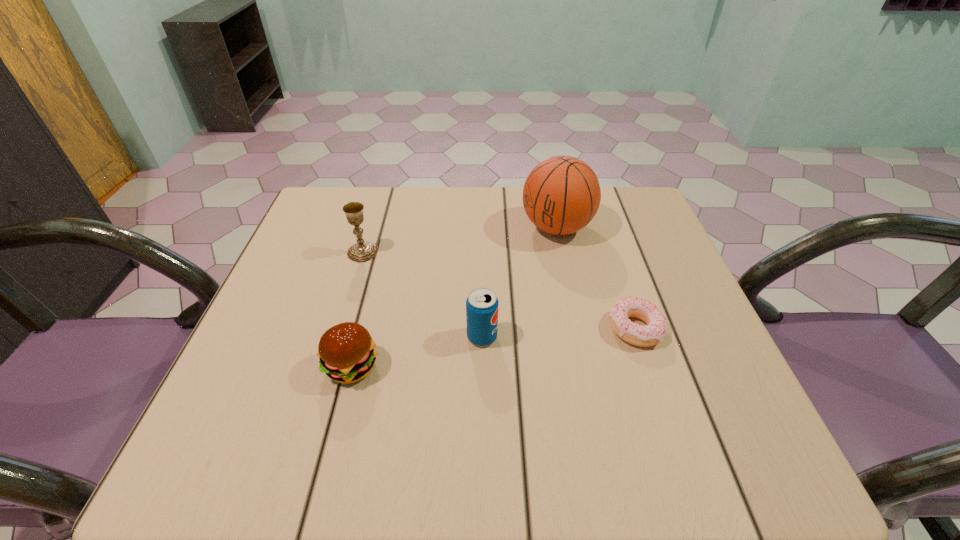
Locate an element on the screen. The height and width of the screenshot is (540, 960). free location that satisfies the following two spatial constraints: 1. on the front side of the chalice; 2. on the left side of the third object from right to left is located at coordinates (337, 337).

The width and height of the screenshot is (960, 540). What are the coordinates of `free space in the image that satisfies the following two spatial constraints: 1. on the front side of the hamburger; 2. on the right side of the chalice` in the screenshot? It's located at (328, 366).